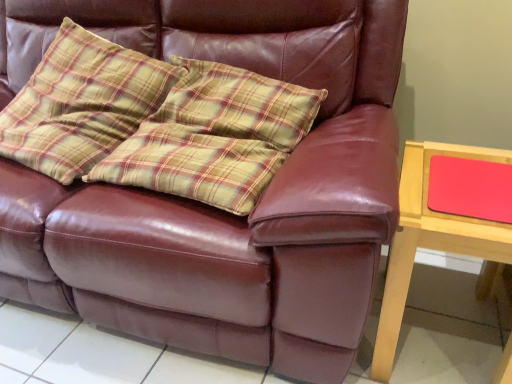
Find the location of a particular element. Image resolution: width=512 pixels, height=384 pixels. free space above matte red mousepad at right (from a real-world perspective) is located at coordinates (472, 178).